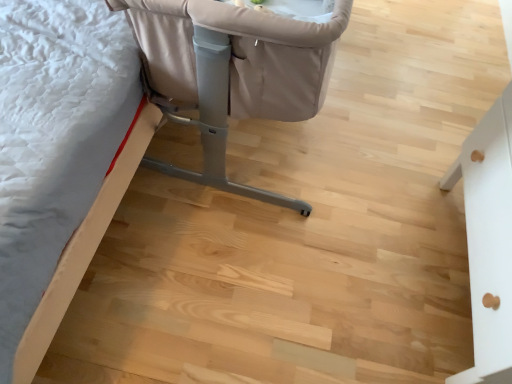
Identify the location of vacant space positioned to the left of white matte drawer at right, which is counted as the first furniture, starting from the right. The width and height of the screenshot is (512, 384). (339, 265).